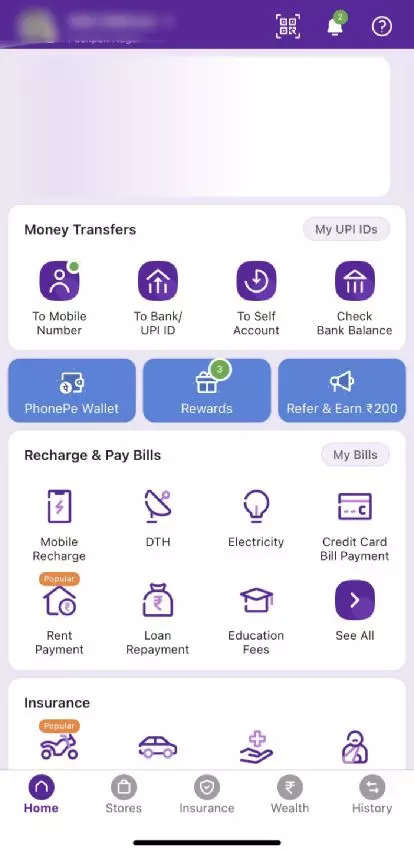
You are a GUI agent. You are given a task and a screenshot of the screen. Output one action in this format:
    pyautogui.click(x=<x>, y=<y>)
    Task: Click on the lightbulb
    This screenshot has height=849, width=414.
    Given the screenshot: What is the action you would take?
    pyautogui.click(x=266, y=514)